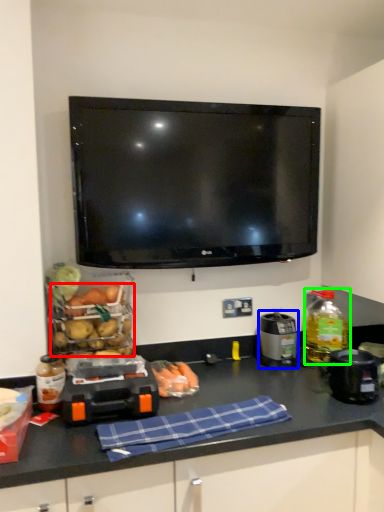
Question: Which object is the closest to the food (highlighted by a red box)? Choose among these: appliance (highlighted by a blue box) or bottle (highlighted by a green box).

Choices:
 (A) appliance
 (B) bottle

Answer: (A)